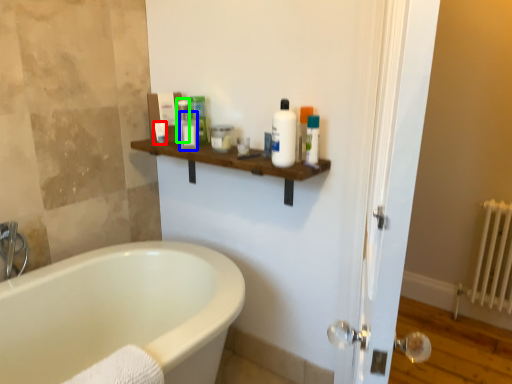
Question: Based on their relative distances, which object is farther from toiletry (highlighted by a red box)? Choose from toiletry (highlighted by a blue box) and toiletry (highlighted by a green box).

Choices:
 (A) toiletry
 (B) toiletry

Answer: (A)